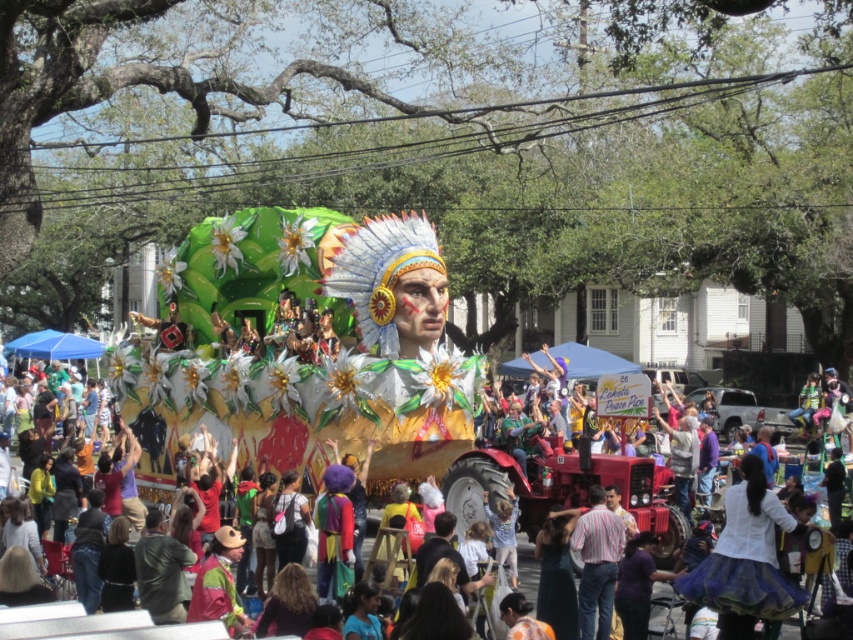
You are a photographer at the parade. You want to capture a photo that includes both the golden metallic float at center and the blue sequined skirt at lower right. Which object should be placed closer to the camera to ensure both are in focus?

The golden metallic float at center should be placed closer to the camera because the blue sequined skirt at lower right is behind it, so positioning the float forward will keep both in focus.